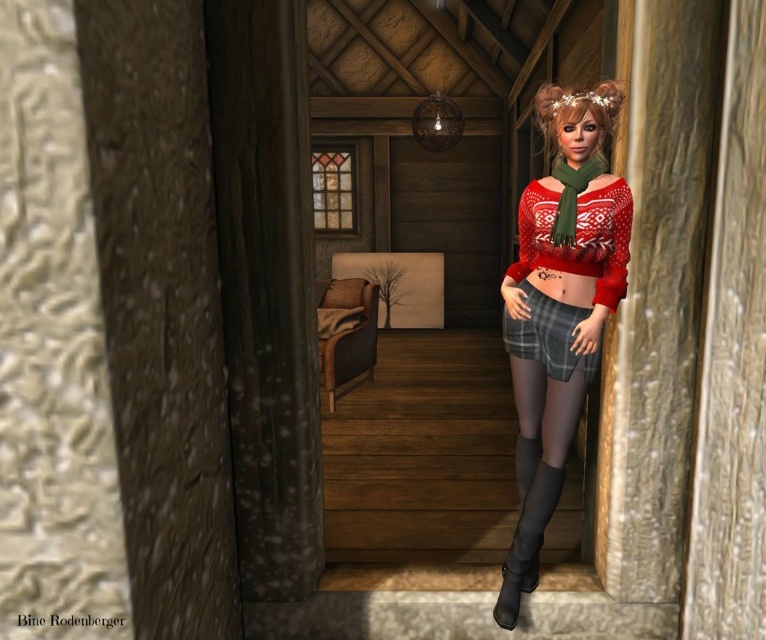
Looking at this image, can you confirm if plaid fabric shorts at center is positioned to the left of black leather boot at lower right?

In fact, plaid fabric shorts at center is to the right of black leather boot at lower right.

The image size is (766, 640). Find the location of `plaid fabric shorts at center`. plaid fabric shorts at center is located at coordinates (548, 336).

What do you see at coordinates (548, 336) in the screenshot? Image resolution: width=766 pixels, height=640 pixels. I see `plaid fabric shorts at center` at bounding box center [548, 336].

The height and width of the screenshot is (640, 766). I want to click on plaid fabric shorts at center, so click(x=548, y=336).

Can you confirm if red matte sweater at center is shorter than black leather boot at lower right?

No, red matte sweater at center is not shorter than black leather boot at lower right.

Does red matte sweater at center have a greater width compared to black leather boot at lower right?

Yes.

The width and height of the screenshot is (766, 640). Identify the location of red matte sweater at center. (558, 308).

Who is more forward, (588, 340) or (529, 340)?

Point (588, 340) is in front.

Who is higher up, red matte sweater at center or plaid fabric shorts at center?

Positioned higher is plaid fabric shorts at center.

Identify the location of red matte sweater at center. The image size is (766, 640). click(x=558, y=308).